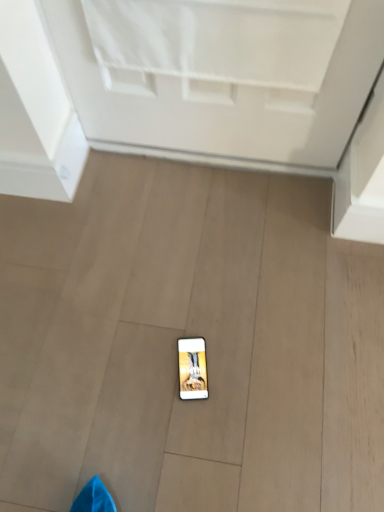
Find the location of a particular element. This screenshot has width=384, height=512. matte black phone at center is located at coordinates (192, 368).

This screenshot has width=384, height=512. Describe the element at coordinates (192, 368) in the screenshot. I see `matte black phone at center` at that location.

Measure the distance between point [183,399] and camera.

They are 3.62 feet apart.

I want to click on matte black phone at center, so click(x=192, y=368).